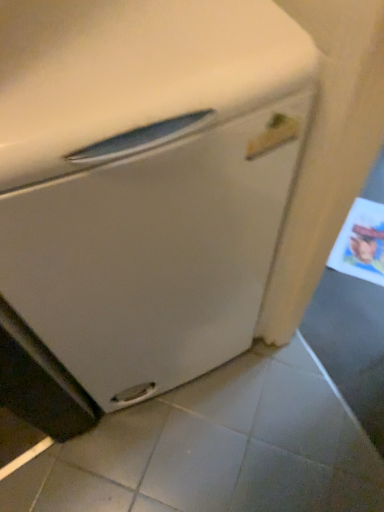
Question: Should I look upward or downward to see white matte refrigerator at center?

Choices:
 (A) down
 (B) up

Answer: (B)